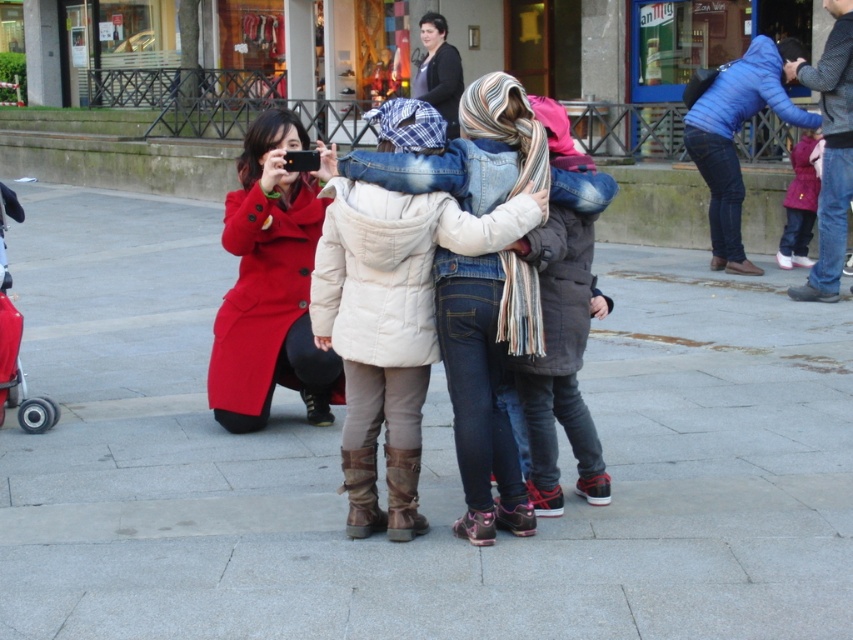
Who is more distant from viewer, (625, 326) or (393, 387)?

The point (625, 326) is more distant.

Find the location of `gray concrete pavement at center`. gray concrete pavement at center is located at coordinates (421, 465).

Can you confirm if gray concrete pavement at center is positioned to the right of matte black jacket at upper center?

No, gray concrete pavement at center is not to the right of matte black jacket at upper center.

Based on the photo, who is positioned more to the left, gray concrete pavement at center or matte black jacket at upper center?

From the viewer's perspective, gray concrete pavement at center appears more on the left side.

Which is behind, point (798, 509) or point (419, 92)?

Positioned behind is point (419, 92).

Find the location of `gray concrete pavement at center`. gray concrete pavement at center is located at coordinates (421, 465).

Between gray concrete pavement at center and matte red coat at center, which one has more height?

With more height is gray concrete pavement at center.

Who is lower down, gray concrete pavement at center or matte red coat at center?

gray concrete pavement at center is below.

Who is more distant from viewer, (71, 336) or (244, 241)?

Point (71, 336)

Identify the location of gray concrete pavement at center. (421, 465).